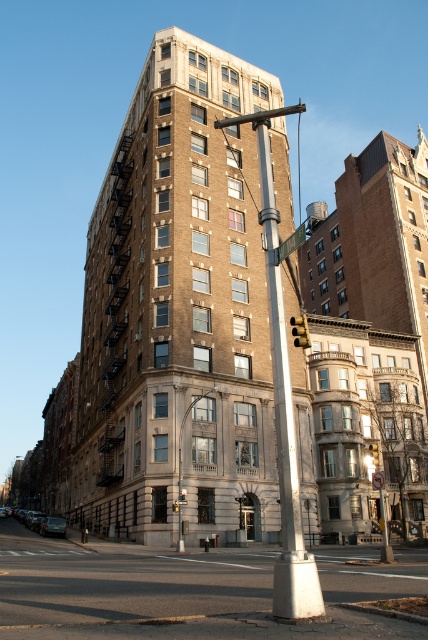
You are standing on the sidewalk facing the tall brick building. You see the polished brass lamp post at center and the metallic silver street sign at center. Which object is closer to you?

The polished brass lamp post at center is closer to you because it is further to the viewer than the metallic silver street sign at center.